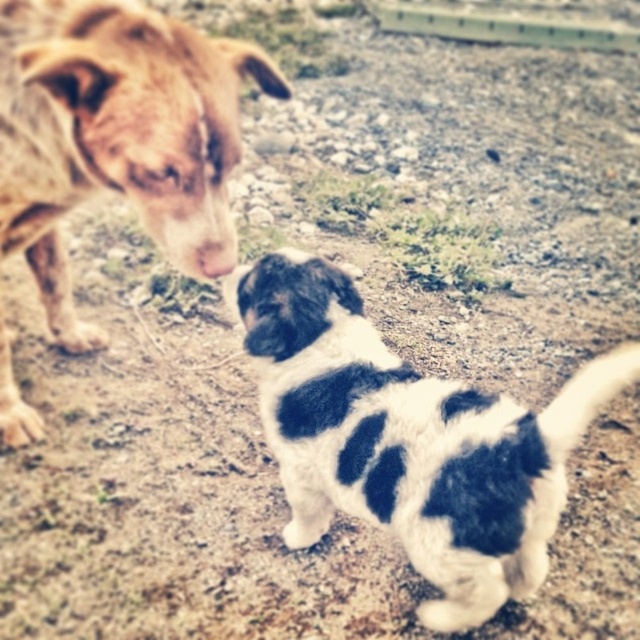
What is the color of the fur at the point with coordinates (410, 440)?

The point at coordinates (410, 440) has black and white fur.

You are a photographer trying to capture a closeup of the smaller dog. You notice two points in the image labeled as point 1 and point 2. Point 1 is at coordinates point (467, 445) and point 2 is at point (88, 76). If you want to focus on the smaller dog, which point should you avoid focusing on?

You should avoid focusing on point 1 at (467, 445) because it is behind the smaller dog, which is located at point 2 at (88, 76). To capture a clear closeup, focus on the point closer to the subject.

You are a photographer standing 10 feet away from a black and white fur at center. You want to take a closeup photo of it. Do you need to move closer or farther away?

The black and white fur at center is 5.50 feet from viewer. Since you are currently 10 feet away, you need to move closer by 4.5 feet to get a closeup.